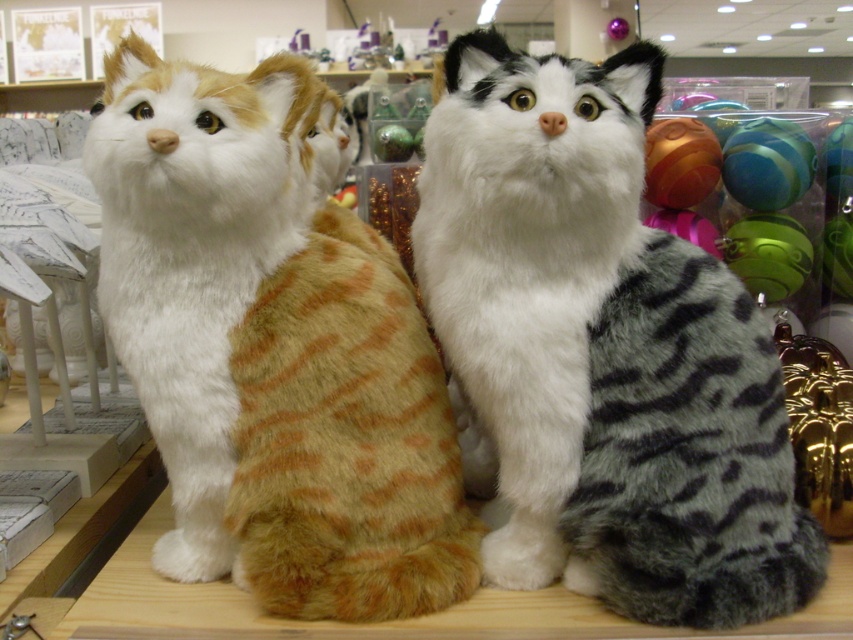
Question: Can you confirm if white fur cat at center is positioned to the right of orange-brown striped plush cat at left?

Choices:
 (A) no
 (B) yes

Answer: (B)

Question: Can you confirm if white fur cat at center is bigger than orange-brown striped plush cat at left?

Choices:
 (A) yes
 (B) no

Answer: (A)

Question: Is white fur cat at center thinner than orange-brown striped plush cat at left?

Choices:
 (A) no
 (B) yes

Answer: (A)

Question: Among these objects, which one is farthest from the camera?

Choices:
 (A) orange-brown striped plush cat at left
 (B) white fur cat at center

Answer: (B)